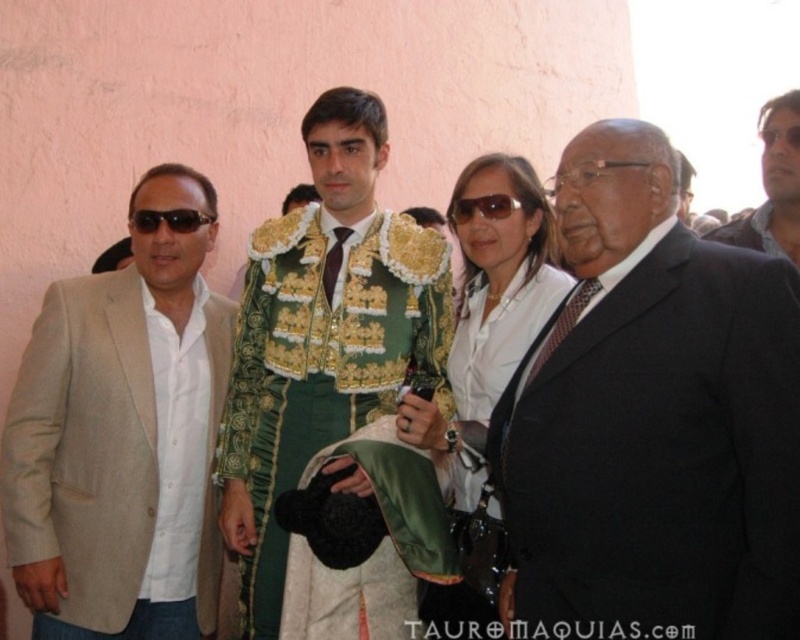
You are a photographer at the event and want to capture a photo where both the green satin jacket at center and the matte black sunglasses at upper right are visible. However, the camera frame can only accommodate objects of a certain height. Based on their heights, which object might need to be adjusted in the composition to ensure both are fully visible?

The green satin jacket at center is much taller than the matte black sunglasses at upper right, so the photographer should adjust the position of the green satin jacket at center to ensure both fit within the camera frame.

You are a photographer trying to capture a group photo of the beige fabric suit at left and the white satin blouse at center. Which person should you position closer to the camera to ensure both are fully visible in the frame?

The beige fabric suit at left should be positioned closer to the camera since its width is less than the white satin blouse at center, allowing both to fit within the frame without overcrowding.